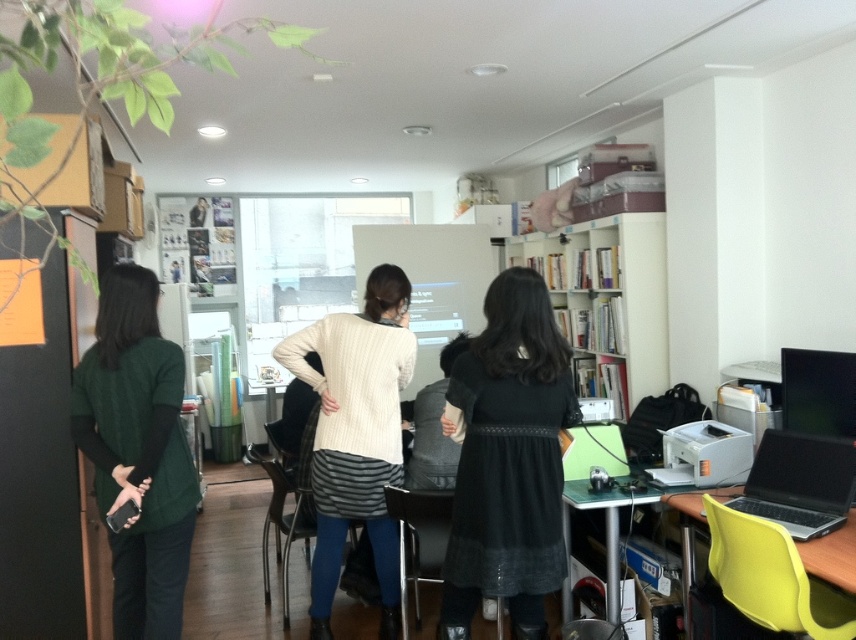
Question: Which object appears closest to the camera in this image?

Choices:
 (A) black matte dress at center
 (B) matte black laptop at lower right

Answer: (A)

Question: Is black matte dress at center to the left of white knitted sweater at center from the viewer's perspective?

Choices:
 (A) no
 (B) yes

Answer: (A)

Question: Is green knitted sweater at left to the left of white glossy bookshelf at upper center from the viewer's perspective?

Choices:
 (A) no
 (B) yes

Answer: (B)

Question: Can you confirm if black glossy monitor at upper right is positioned to the left of matte black laptop at lower right?

Choices:
 (A) no
 (B) yes

Answer: (A)

Question: Considering the real-world distances, which object is farthest from the green knitted sweater at left?

Choices:
 (A) white glossy bookshelf at upper center
 (B) matte black laptop at lower right

Answer: (A)

Question: Estimate the real-world distances between objects in this image. Which object is closer to the white glossy bookshelf at upper center?

Choices:
 (A) silver metallic laptop at lower right
 (B) green knitted sweater at left
 (C) black glossy monitor at upper right

Answer: (C)